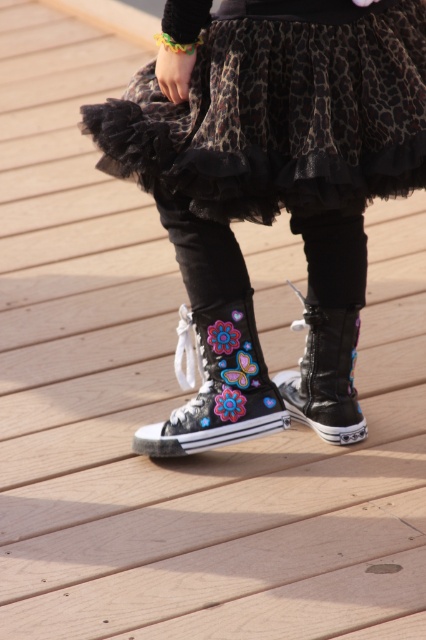
You are a fashion designer trying to create a cohesive outfit. You have the leopard print tulle skirt at center and the black canvas shoe at center in your design. Given their distance apart in the image, do you think they are part of the same outfit?

The leopard print tulle skirt at center and the black canvas shoe at center are 56.88 centimeters apart, which suggests they are part of the same outfit as they are positioned closely together on the person.

You are a fashion designer observing the leopard print tulle skirt at center and the black canvas shoe at center. Which item is positioned closer to the front of the outfit?

The leopard print tulle skirt at center is closer to the viewer than the black canvas shoe at center, so it is positioned closer to the front of the outfit.